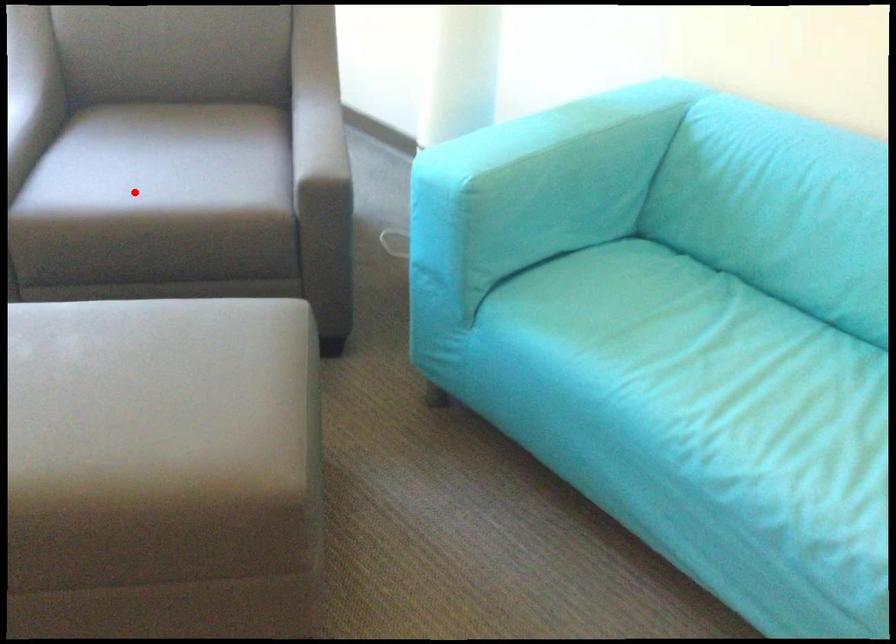
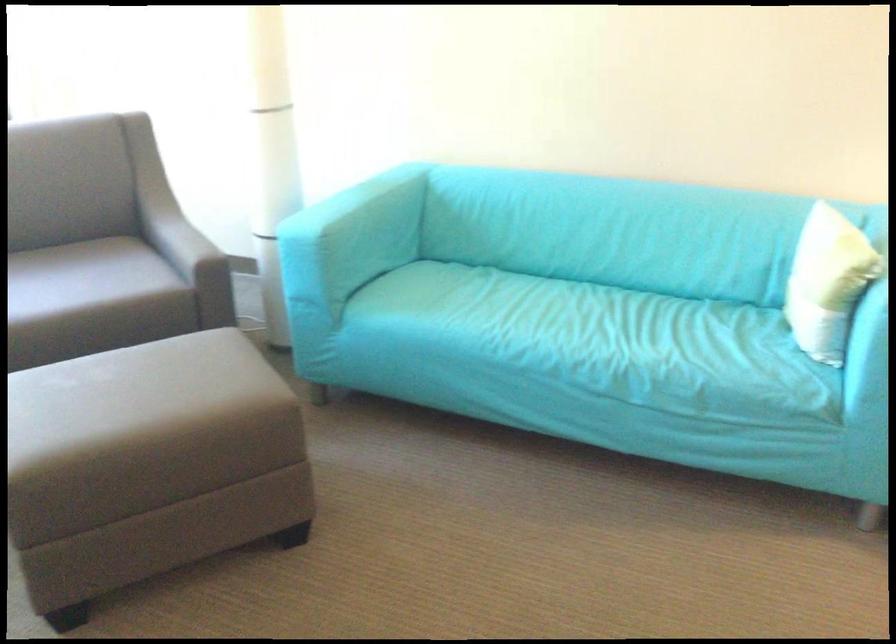
Question: I am providing you with two images of the same scene from different viewpoints. A red point is marked on the first image. Can you still see the location of the red point in image 2?

Choices:
 (A) Yes
 (B) No

Answer: (A)